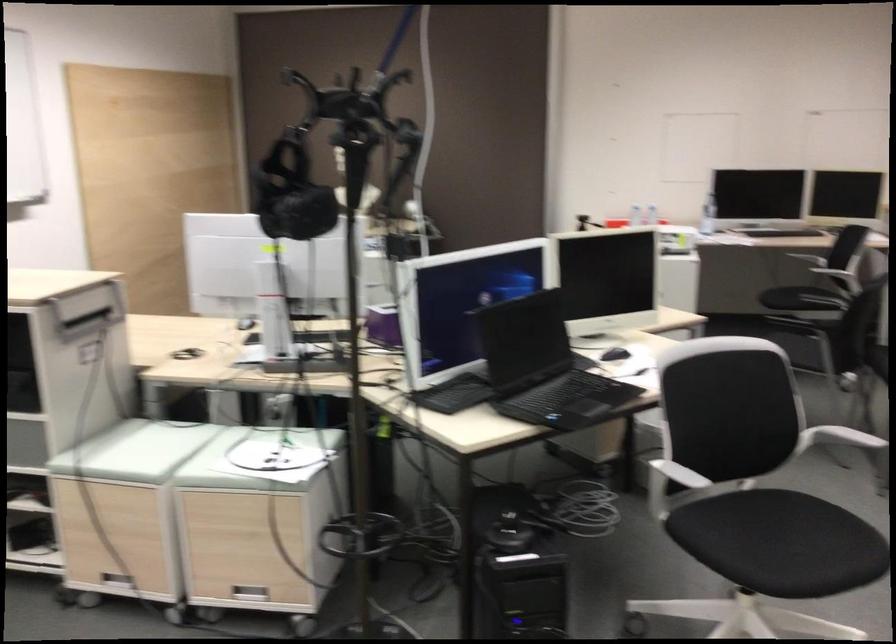
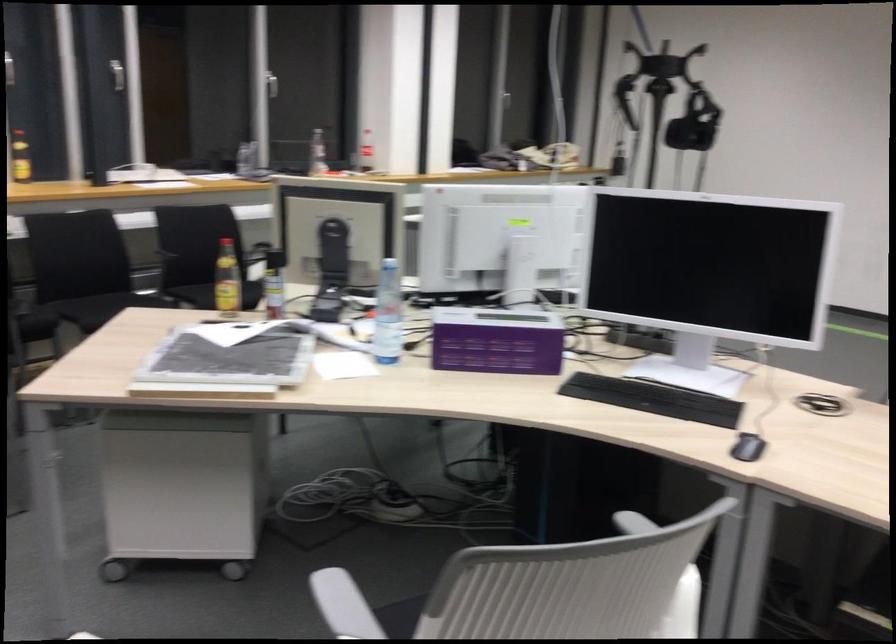
Where in the second image is the point corresponding to (x=235, y=330) from the first image?

(747, 447)